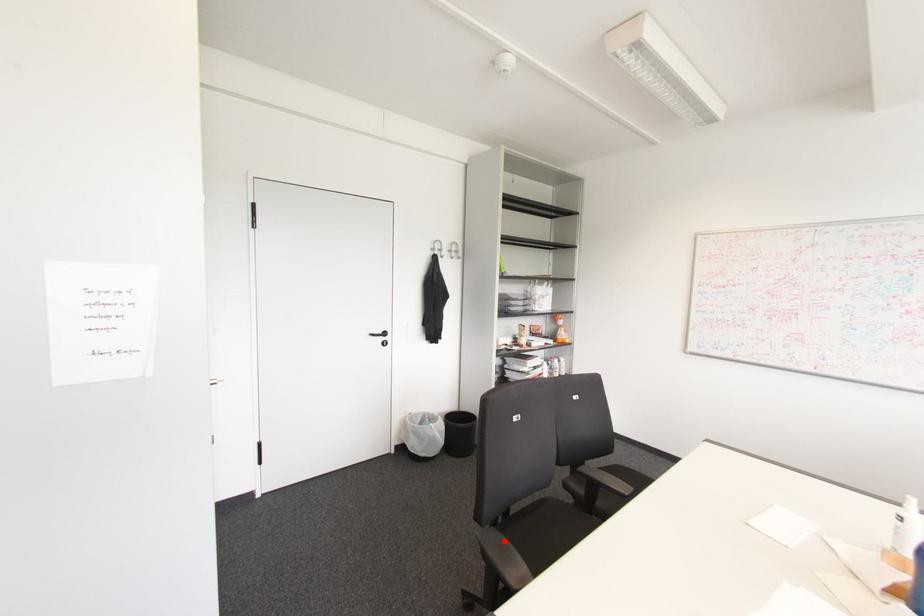
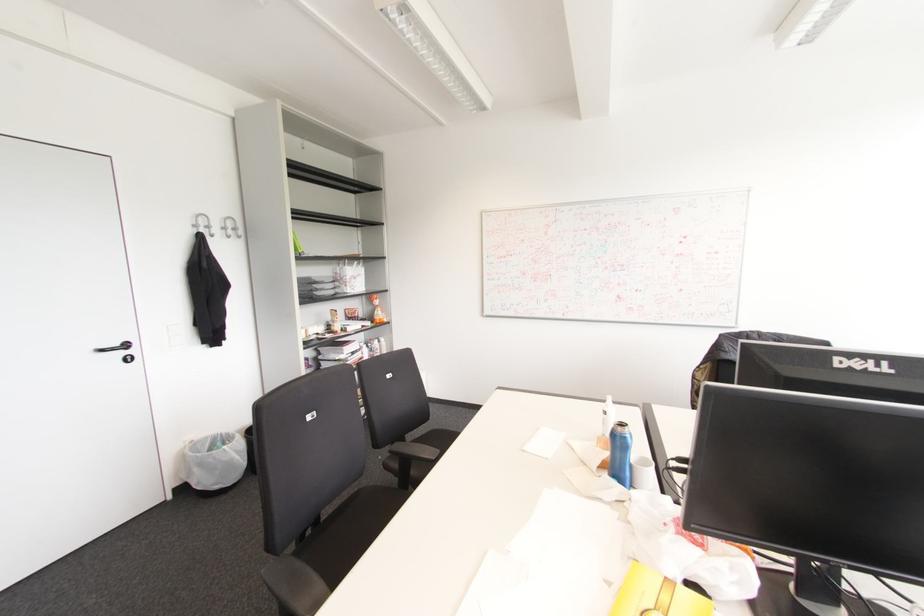
Question: I am providing you with two images of the same scene from different viewpoints. A red point is shown in image1. For the corresponding object point in image2, is it positioned nearer or farther from the camera?

Choices:
 (A) Nearer
 (B) Farther

Answer: (B)